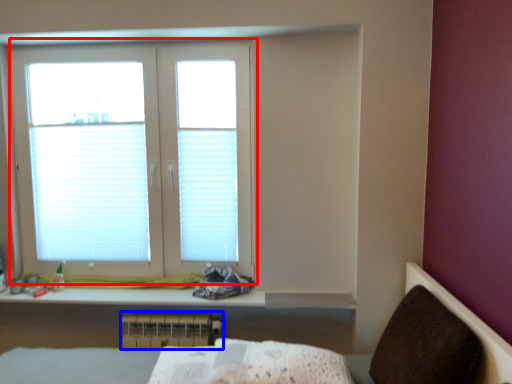
Question: Which object appears closest to the camera in this image, window (highlighted by a red box) or radiator (highlighted by a blue box)?

Choices:
 (A) window
 (B) radiator

Answer: (A)